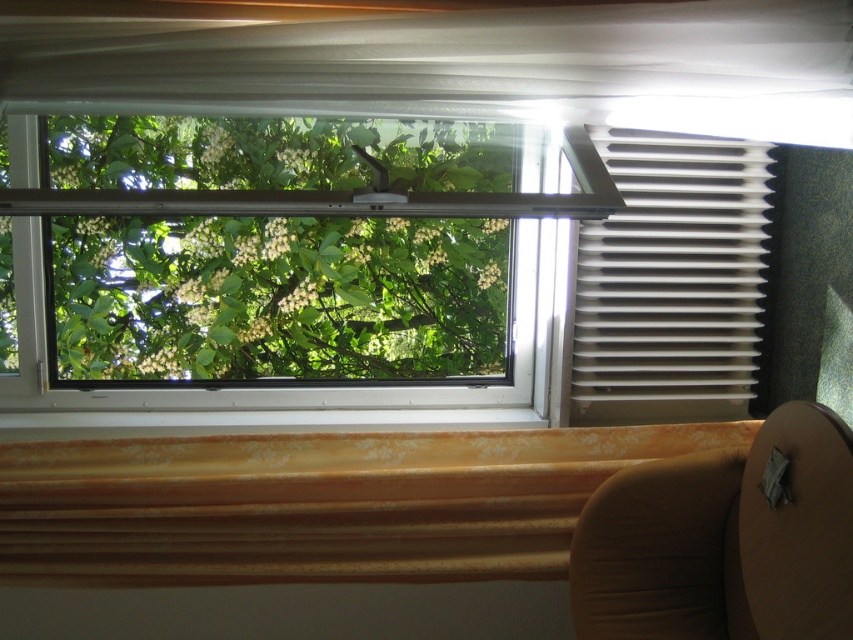
Who is higher up, yellow textured curtain at lower center or brown fabric chair at lower right?

yellow textured curtain at lower center is above.

Which of these two, yellow textured curtain at lower center or brown fabric chair at lower right, stands shorter?

yellow textured curtain at lower center

Find the location of `yellow textured curtain at lower center`. yellow textured curtain at lower center is located at coordinates (314, 502).

Locate an element on the screen. yellow textured curtain at lower center is located at coordinates (314, 502).

Is yellow textured curtain at lower center smaller than white plastic blinds at right?

Actually, yellow textured curtain at lower center might be larger than white plastic blinds at right.

Which is behind, point (178, 573) or point (607, 349)?

Point (607, 349)

At what (x,y) coordinates should I click in order to perform the action: click on yellow textured curtain at lower center. Please return your answer as a coordinate pair (x, y). The height and width of the screenshot is (640, 853). Looking at the image, I should click on pos(314,502).

Can you confirm if green leafy tree at center is positioned to the left of yellow textured curtain at lower center?

Indeed, green leafy tree at center is positioned on the left side of yellow textured curtain at lower center.

Between green leafy tree at center and yellow textured curtain at lower center, which one has more height?

green leafy tree at center

Is point (67, 241) positioned in front of point (450, 506)?

No, it is behind (450, 506).

This screenshot has width=853, height=640. Find the location of `green leafy tree at center`. green leafy tree at center is located at coordinates (276, 298).